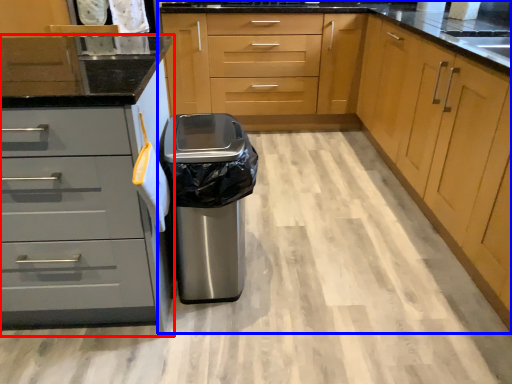
Question: Which object appears farthest to the camera in this image, cabinetry (highlighted by a red box) or cabinetry (highlighted by a blue box)?

Choices:
 (A) cabinetry
 (B) cabinetry

Answer: (A)